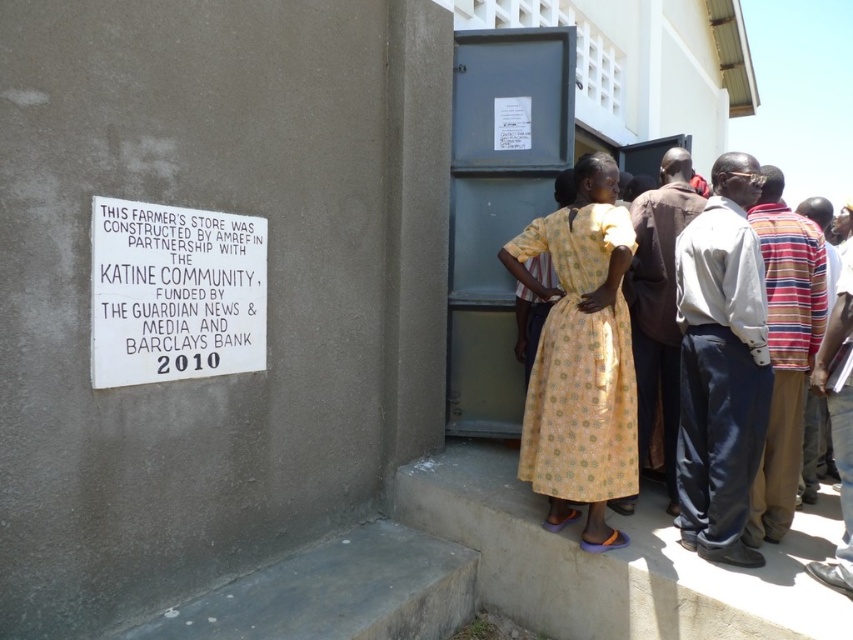
You are a photographer standing in front of the building. You want to take a picture of the yellow printed dress at center while also including the white paper sign at upper left in the frame. Based on their positions, can you include both in the same photo without moving your camera position?

The white paper sign at upper left is positioned on the left side of the yellow printed dress at center, so yes, you can include both in the same photo by framing the shot to capture the left side of the yellow printed dress at center and the white paper sign at upper left together.

You are a visitor approaching the building and want to read the sign on the wall. There is a yellow printed dress at center blocking your view. Can you see the white paper sign at upper left from your current position?

The white paper sign at upper left is not as tall as the yellow printed dress at center, so it is possible that the dress is blocking your view of the sign.

You are a painter who needs to cover both the white paper sign at upper left and the yellow printed dress at center with paint. Which object requires more paint to cover its entire surface?

The yellow printed dress at center requires more paint because it has a greater width than the white paper sign at upper left.